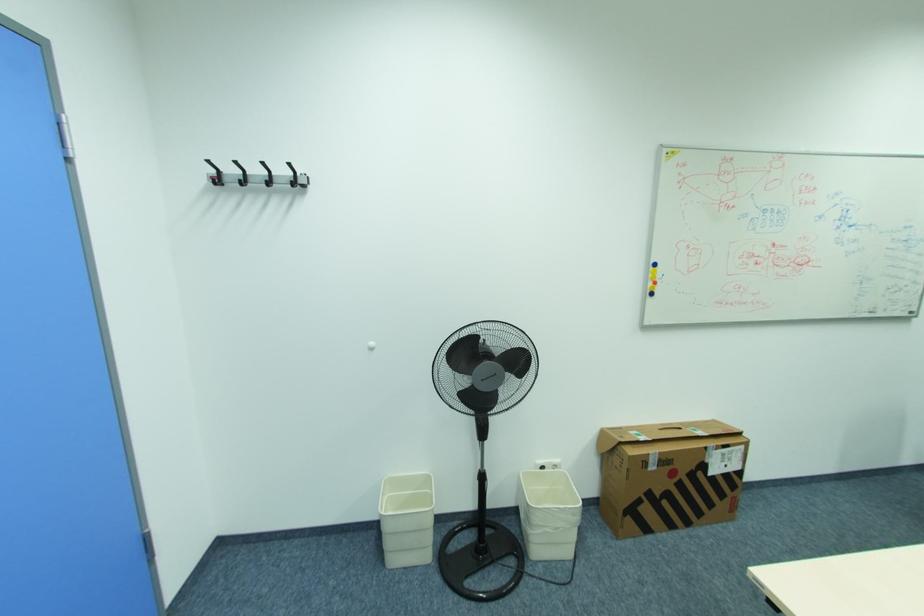
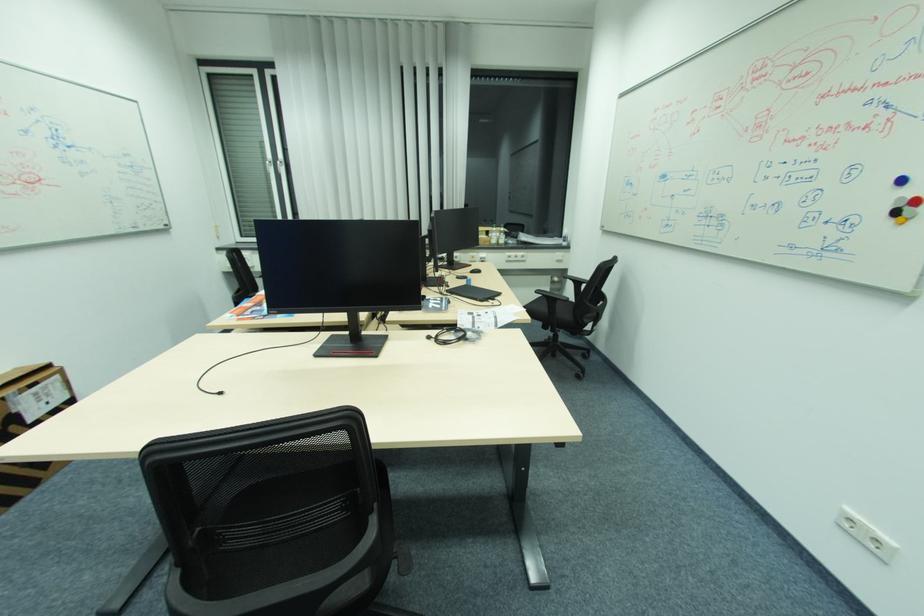
Find the pixel in the second image that matches pixel 711 448 in the first image.

(7, 399)